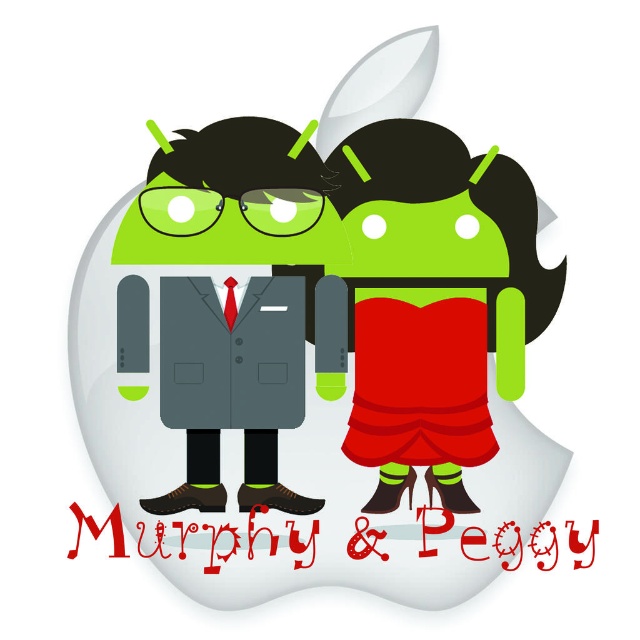
Is matte black suit at center taller than matte gray suit at center?

Correct, matte black suit at center is much taller as matte gray suit at center.

Which is more to the left, matte black suit at center or matte gray suit at center?

matte gray suit at center

This screenshot has height=640, width=640. I want to click on matte black suit at center, so click(x=316, y=353).